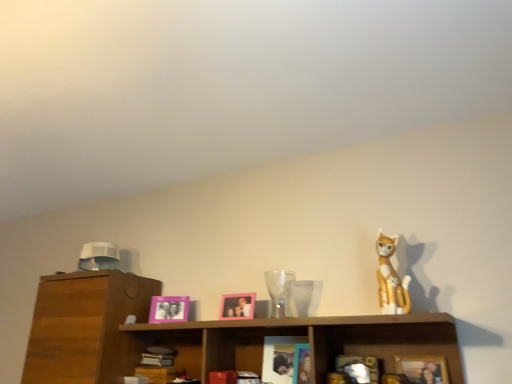
Question: From a real-world perspective, is pink plastic picture frame at center, which is the third picture frame in front-to-back order, above or below pink plastic picture frame at center, arranged as the 2th picture frame when viewed from the back?

Choices:
 (A) above
 (B) below

Answer: (B)

Question: Is pink plastic picture frame at center, which is the third picture frame in front-to-back order, bigger or smaller than pink plastic picture frame at center, which ranks as the second picture frame in right-to-left order?

Choices:
 (A) small
 (B) big

Answer: (B)

Question: Which of these objects is positioned closest to the pink plastic picture frame at center, the first picture frame when ordered from left to right?

Choices:
 (A) pink plastic picture frame at center, which ranks as the second picture frame in right-to-left order
 (B) matte orange figurine at upper right
 (C) transparent glass vase at center
 (D) matte pink picture frame at center, arranged as the third picture frame when viewed from the left
 (E) wooden shelf at center

Answer: (A)

Question: Which object is positioned closest to the transparent glass vase at center?

Choices:
 (A) wooden shelf at center
 (B) matte orange figurine at upper right
 (C) matte pink picture frame at center, which is the third picture frame in back-to-front order
 (D) pink plastic picture frame at center, which ranks as the second picture frame in right-to-left order
 (E) pink plastic picture frame at center, the third picture frame positioned from the right

Answer: (D)